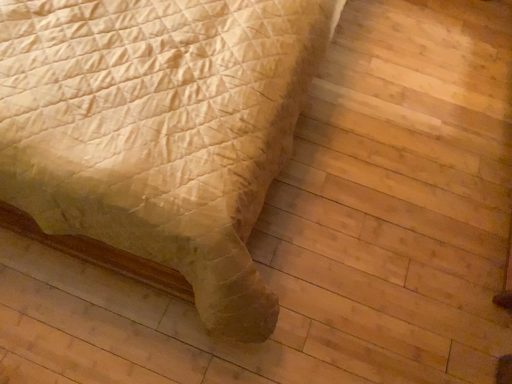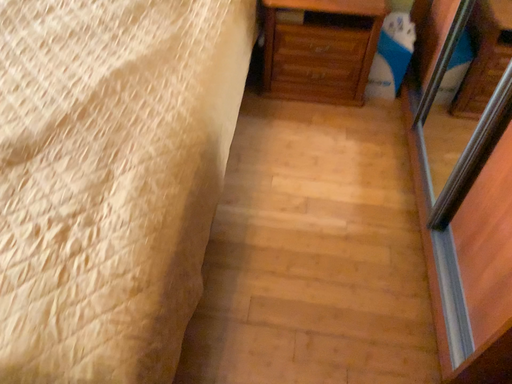
Question: How did the camera likely rotate when shooting the video?

Choices:
 (A) rotated downward
 (B) rotated upward

Answer: (B)